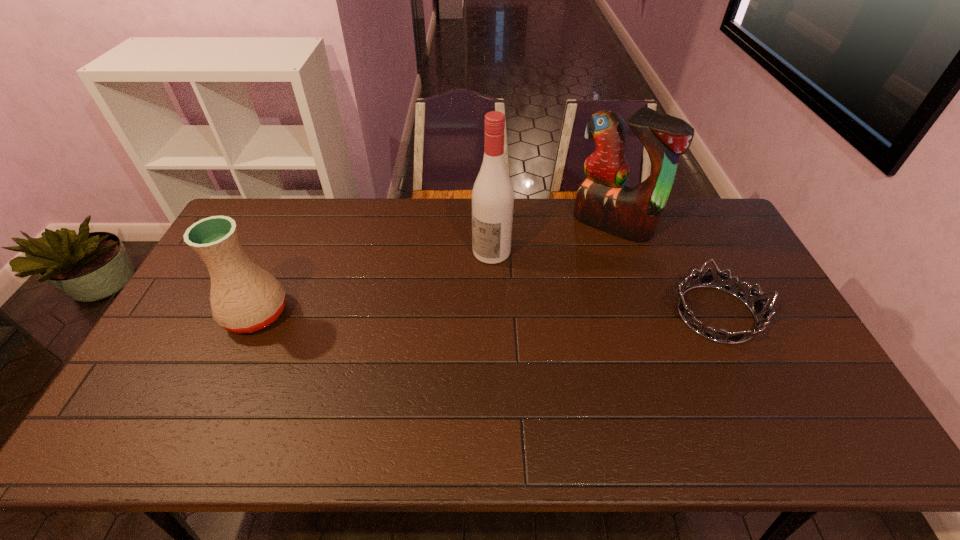
Find the location of a particular element. free space that satisfies the following two spatial constraints: 1. on the back side of the leftmost object; 2. on the left side of the third shortest object is located at coordinates (297, 224).

The image size is (960, 540). What are the coordinates of `vacant space that satisfies the following two spatial constraints: 1. on the front side of the second tallest object; 2. on the front-facing side of the shortest object` in the screenshot? It's located at (641, 314).

Find the location of a particular element. Image resolution: width=960 pixels, height=540 pixels. free space that satisfies the following two spatial constraints: 1. on the back side of the pottery; 2. on the front-facing side of the shortest object is located at coordinates (256, 314).